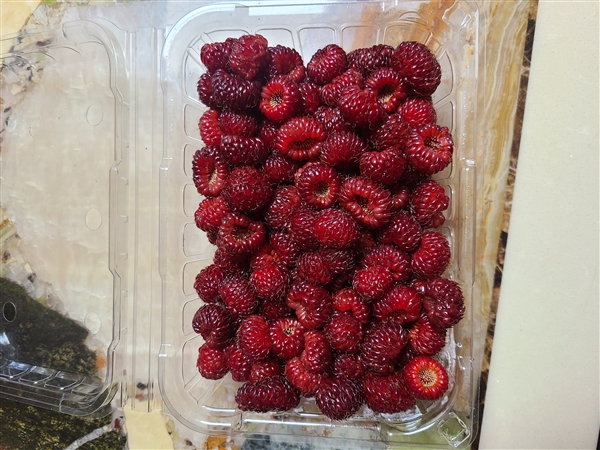
Where is `surface`? surface is located at coordinates (140, 440).